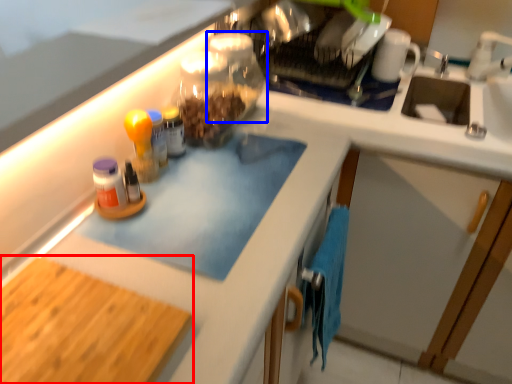
Question: Among these objects, which one is farthest to the camera, cutting board (highlighted by a red box) or glass jar (highlighted by a blue box)?

Choices:
 (A) cutting board
 (B) glass jar

Answer: (B)